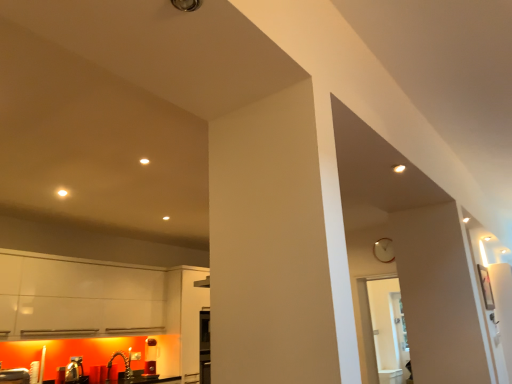
The height and width of the screenshot is (384, 512). What do you see at coordinates (72, 372) in the screenshot?
I see `brushed metal sink at lower left` at bounding box center [72, 372].

The image size is (512, 384). What are the coordinates of `wooden clock at upper right` in the screenshot? It's located at (384, 250).

The image size is (512, 384). What do you see at coordinates (388, 327) in the screenshot? I see `transparent glass door at center` at bounding box center [388, 327].

Measure the distance between point (x=405, y=336) and camera.

Point (x=405, y=336) is 5.95 meters away from camera.

Find the location of a particular element. This screenshot has width=512, height=384. brushed metal sink at lower left is located at coordinates (72, 372).

Considering the relative positions of brushed metal sink at lower left and transparent glass door at center in the image provided, is brushed metal sink at lower left to the left of transparent glass door at center from the viewer's perspective?

Yes, brushed metal sink at lower left is to the left of transparent glass door at center.

From the image's perspective, which object appears higher, brushed metal sink at lower left or transparent glass door at center?

transparent glass door at center appears higher in the image.

Is brushed metal sink at lower left thinner than transparent glass door at center?

Correct, the width of brushed metal sink at lower left is less than that of transparent glass door at center.

What's the angular difference between brushed metal sink at lower left and transparent glass door at center's facing directions?

There is a 91.2-degree angle between the facing directions of brushed metal sink at lower left and transparent glass door at center.

Does wooden clock at upper right have a lesser height compared to transparent glass door at center?

Correct, wooden clock at upper right is not as tall as transparent glass door at center.

How different are the orientations of wooden clock at upper right and transparent glass door at center in degrees?

There is a 1.45-degree angle between the facing directions of wooden clock at upper right and transparent glass door at center.

Is wooden clock at upper right completely or partially outside of transparent glass door at center?

Indeed, wooden clock at upper right is completely outside transparent glass door at center.

Is transparent glass door at center at the back of wooden clock at upper right?

No, wooden clock at upper right is not facing the opposite direction of transparent glass door at center.

Is brushed metal sink at lower left not within wooden clock at upper right?

Yes.

Considering the sizes of objects brushed metal sink at lower left and wooden clock at upper right in the image provided, who is bigger, brushed metal sink at lower left or wooden clock at upper right?

brushed metal sink at lower left is bigger.

Relative to wooden clock at upper right, is brushed metal sink at lower left in front or behind?

brushed metal sink at lower left is positioned closer to the viewer than wooden clock at upper right.

Is brushed metal sink at lower left directly adjacent to wooden clock at upper right?

No, brushed metal sink at lower left is not touching wooden clock at upper right.

Measure the distance between transparent glass door at center and brushed metal sink at lower left.

transparent glass door at center and brushed metal sink at lower left are 3.94 meters apart.

Is transparent glass door at center not near brushed metal sink at lower left?

Absolutely, transparent glass door at center is distant from brushed metal sink at lower left.

Looking at this image, does transparent glass door at center have a lesser width compared to brushed metal sink at lower left?

No, transparent glass door at center is not thinner than brushed metal sink at lower left.

Is transparent glass door at center in front of or behind brushed metal sink at lower left in the image?

Visually, transparent glass door at center is located behind brushed metal sink at lower left.

Considering the sizes of objects transparent glass door at center and wooden clock at upper right in the image provided, who is taller, transparent glass door at center or wooden clock at upper right?

transparent glass door at center is taller.

Is transparent glass door at center not close to wooden clock at upper right?

Actually, transparent glass door at center and wooden clock at upper right are a little close together.

Identify the location of glass door below the wooden clock at upper right (from the image's perspective). (388, 327).

Is brushed metal sink at lower left at the back of wooden clock at upper right?

wooden clock at upper right does not have its back to brushed metal sink at lower left.

Can you confirm if wooden clock at upper right is smaller than brushed metal sink at lower left?

Indeed, wooden clock at upper right has a smaller size compared to brushed metal sink at lower left.

Between wooden clock at upper right and brushed metal sink at lower left, which one is positioned behind?

wooden clock at upper right.

There is a brushed metal sink at lower left. Where is `clock above it (from a real-world perspective)`? The height and width of the screenshot is (384, 512). clock above it (from a real-world perspective) is located at coordinates (384, 250).

Image resolution: width=512 pixels, height=384 pixels. In order to click on glass door above the brushed metal sink at lower left (from the image's perspective) in this screenshot , I will do `click(388, 327)`.

Where is `clock that is on the right side of transparent glass door at center`? This screenshot has height=384, width=512. clock that is on the right side of transparent glass door at center is located at coordinates (384, 250).

Looking at the image, which one is located further to transparent glass door at center, wooden clock at upper right or brushed metal sink at lower left?

The object further to transparent glass door at center is brushed metal sink at lower left.

Estimate the real-world distances between objects in this image. Which object is closer to brushed metal sink at lower left, transparent glass door at center or wooden clock at upper right?

The object closer to brushed metal sink at lower left is wooden clock at upper right.

From the image, which object appears to be farther from wooden clock at upper right, brushed metal sink at lower left or transparent glass door at center?

brushed metal sink at lower left lies further to wooden clock at upper right than the other object.

In the scene shown: When comparing their distances from wooden clock at upper right, does transparent glass door at center or brushed metal sink at lower left seem closer?

Result: Among the two, transparent glass door at center is located nearer to wooden clock at upper right.

Which object lies further to the anchor point transparent glass door at center, brushed metal sink at lower left or wooden clock at upper right?

Among the two, brushed metal sink at lower left is located further to transparent glass door at center.

Based on their spatial positions, is wooden clock at upper right or transparent glass door at center closer to brushed metal sink at lower left?

wooden clock at upper right lies closer to brushed metal sink at lower left than the other object.

This screenshot has height=384, width=512. I want to click on glass door between brushed metal sink at lower left and wooden clock at upper right, so click(x=388, y=327).